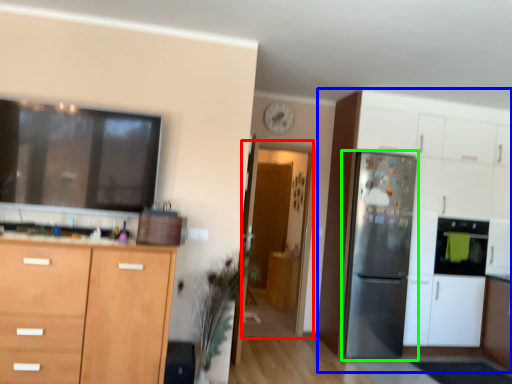
Question: Which object is the closest to the glass door (highlighted by a red box)? Choose among these: cabinetry (highlighted by a blue box) or refrigerator (highlighted by a green box).

Choices:
 (A) cabinetry
 (B) refrigerator

Answer: (A)